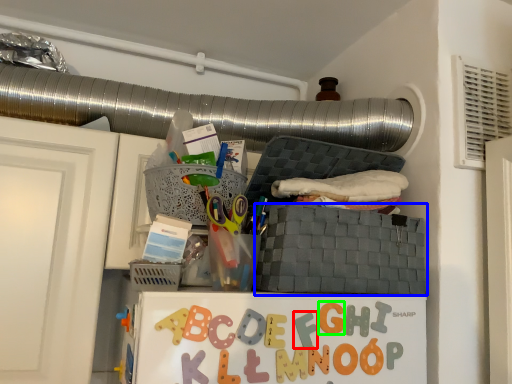
Question: Which object is the farthest from alphabet (highlighted by a red box)? Choose among these: basket (highlighted by a blue box) or letter (highlighted by a green box).

Choices:
 (A) basket
 (B) letter

Answer: (A)